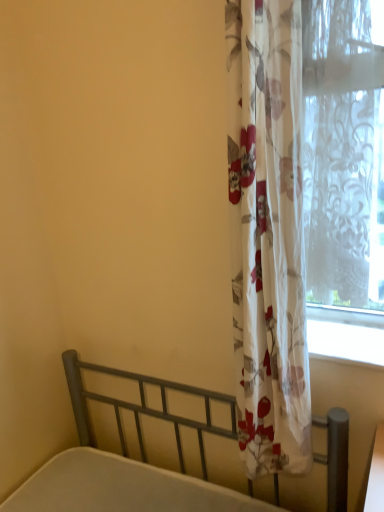
What do you see at coordinates (344, 178) in the screenshot?
I see `translucent floral curtain at right` at bounding box center [344, 178].

Find the location of a particular element. Image resolution: width=384 pixels, height=512 pixels. translucent floral curtain at right is located at coordinates (344, 178).

Where is `translucent floral curtain at right`? Image resolution: width=384 pixels, height=512 pixels. translucent floral curtain at right is located at coordinates (344, 178).